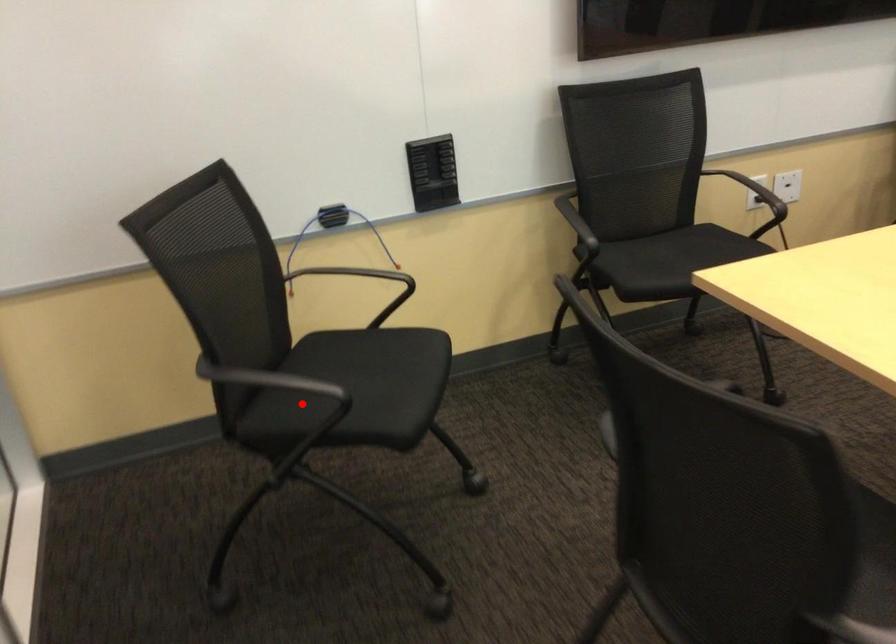
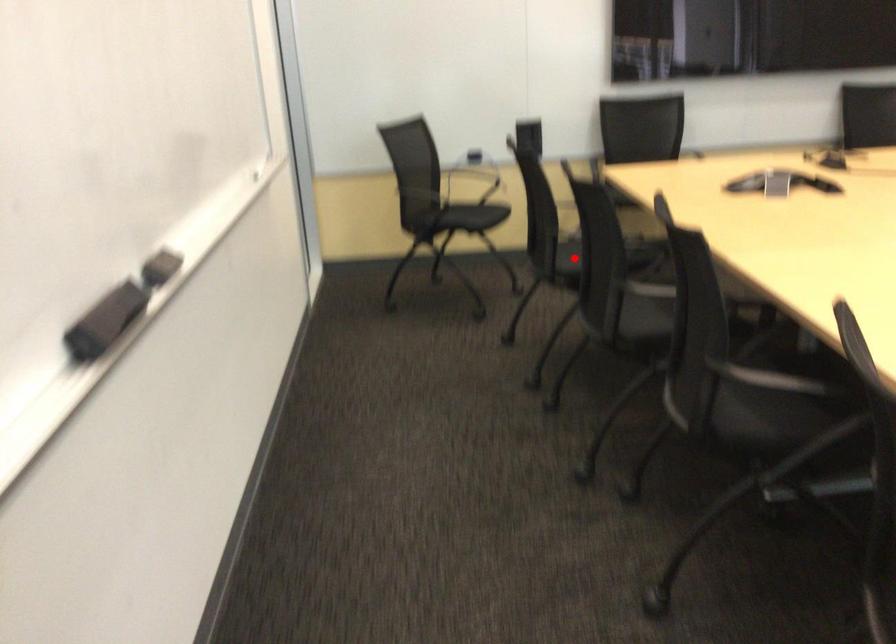
I am providing you with two images of the same scene from different viewpoints. A red point is marked on the first image and another point is marked on the second image. Is the marked point in image1 the same physical position as the marked point in image2?

No